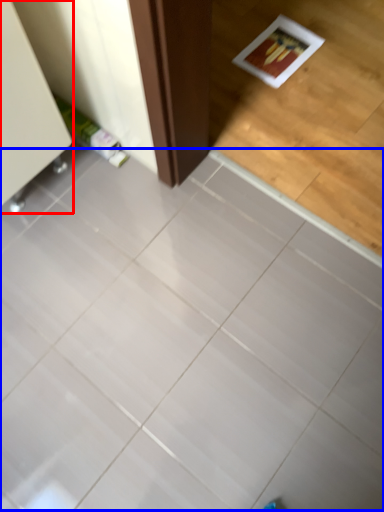
Question: Which point is closer to the camera, furniture (highlighted by a red box) or ceramic tile (highlighted by a blue box)?

Choices:
 (A) furniture
 (B) ceramic tile

Answer: (B)